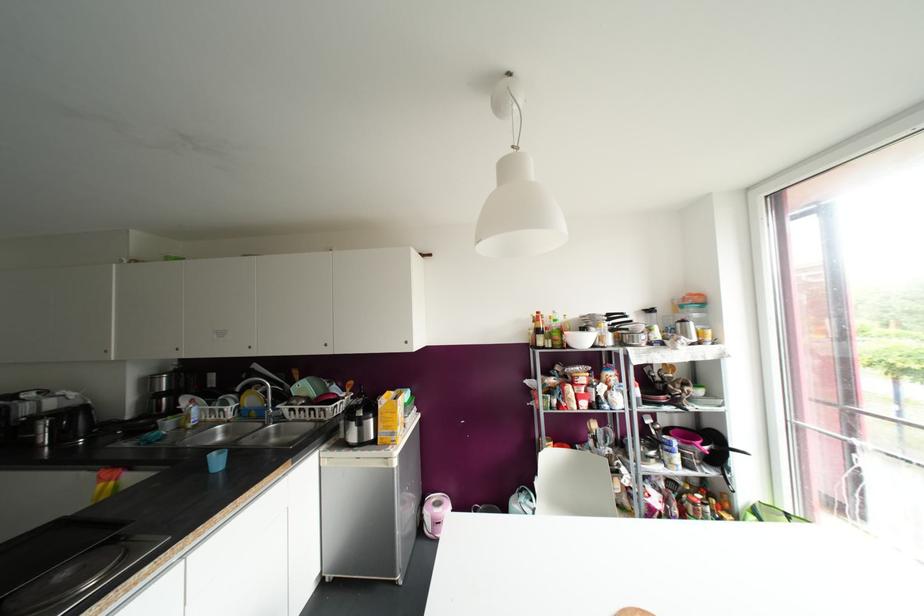
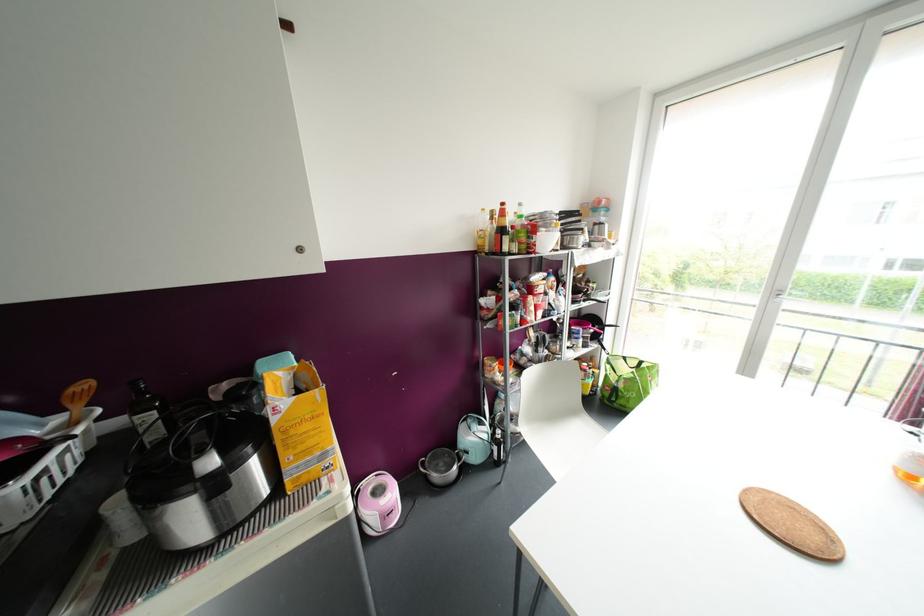
Locate, in the second image, the point that corresponds to [786,515] in the first image.

(624, 358)